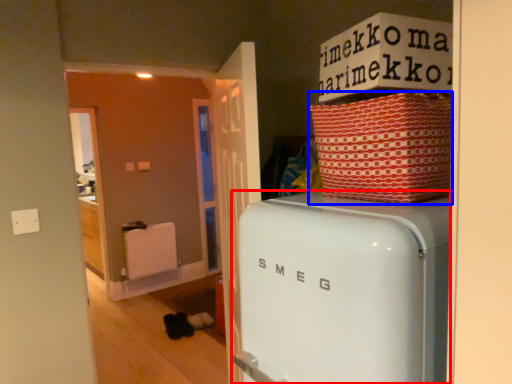
Question: Which object is further to the camera taking this photo, home appliance (highlighted by a red box) or crate (highlighted by a blue box)?

Choices:
 (A) home appliance
 (B) crate

Answer: (B)